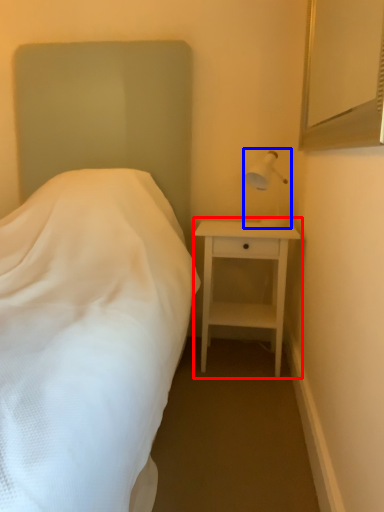
Question: Among these objects, which one is nearest to the camera, nightstand (highlighted by a red box) or bedside lamp (highlighted by a blue box)?

Choices:
 (A) nightstand
 (B) bedside lamp

Answer: (B)